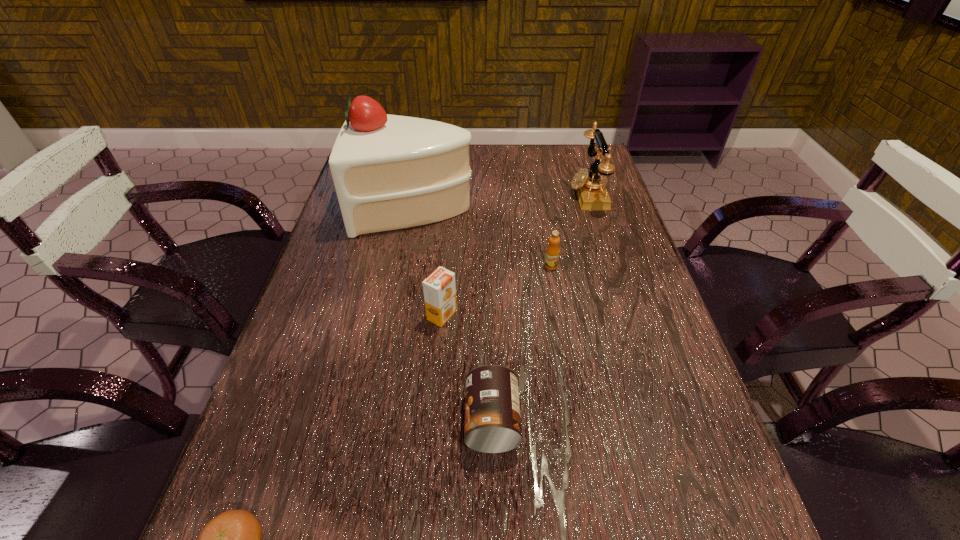
This screenshot has width=960, height=540. Find the location of `object that is at the left edge`. object that is at the left edge is located at coordinates (390, 172).

Find the location of a particular element. The height and width of the screenshot is (540, 960). object that is at the right edge is located at coordinates (591, 192).

At what (x,y) coordinates should I click in order to perform the action: click on object that is at the far left corner. Please return your answer as a coordinate pair (x, y). Image resolution: width=960 pixels, height=540 pixels. Looking at the image, I should click on (390, 172).

The width and height of the screenshot is (960, 540). Find the location of `object situated at the far right corner`. object situated at the far right corner is located at coordinates (591, 192).

Identify the location of free space at the far edge. This screenshot has width=960, height=540. (473, 172).

In the image, there is a desktop. Identify the location of vacant space at the left edge. (324, 399).

Identify the location of free space at the right edge. Image resolution: width=960 pixels, height=540 pixels. (678, 522).

I want to click on vacant space at the far right corner, so click(574, 146).

The image size is (960, 540). I want to click on blank region between the fourth nearest object and the fifth farthest object, so click(521, 343).

I want to click on free space that is in between the left orange juice and the cake, so click(428, 262).